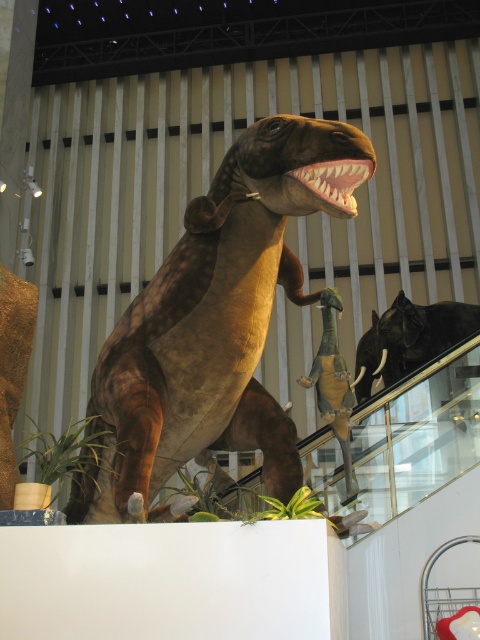
You are a museum visitor standing in front of the brown matte dinosaur at center and the shiny green plastic dinosaur at center. Which dinosaur is positioned to the right side?

The shiny green plastic dinosaur at center is positioned to the right side of the brown matte dinosaur at center.

You are a visitor at the museum and see the brown matte dinosaur at center and the shiny green plastic dinosaur at center. Which one is positioned higher in the image?

The brown matte dinosaur at center is located above the shiny green plastic dinosaur at center, so it is positioned higher in the image.

You are standing in a museum and see the brown matte dinosaur at center. If you take a step forward, how much closer will you be to the dinosaur?

The brown matte dinosaur at center is currently 8.06 feet away from you. If you take a step forward, you will reduce the distance by approximately 1 foot, making the new distance about 7.06 feet.